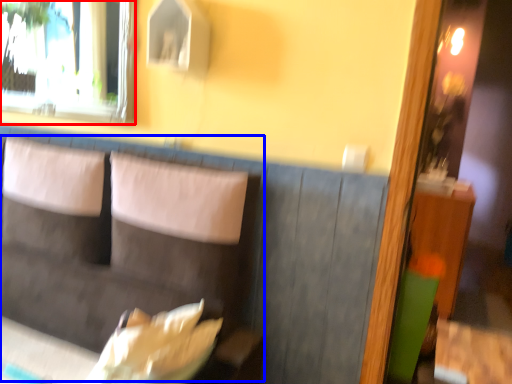
Question: Which point is further to the camera, window (highlighted by a red box) or couch (highlighted by a blue box)?

Choices:
 (A) window
 (B) couch

Answer: (A)